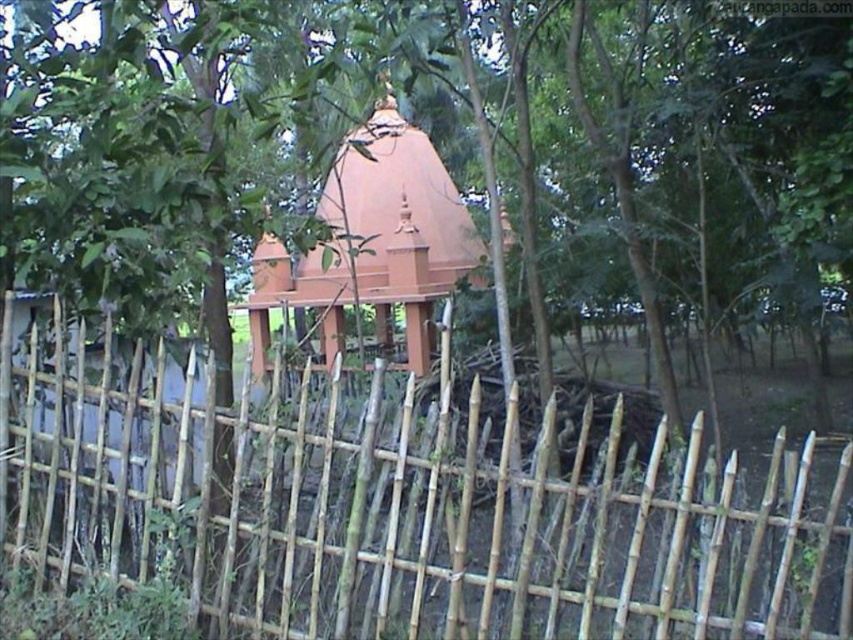
You are a construction worker needing to transport materials from the bamboo fence at center to the matte orange water tower at center. The materials require a cart that can carry up to 15 meters. Can you safely transport the materials using this cart?

The distance between the bamboo fence at center and the matte orange water tower at center is 10.34 meters, which is within the cart capacity of 15 meters. Therefore, you can safely transport the materials using this cart.

You are standing in front of the traditional structure and notice both the bamboo fence at center and the matte orange water tower at center. Which object is taller?

The bamboo fence at center is taller than the matte orange water tower at center.

You are standing in front of the temple structure and want to touch the bamboo fence. Is the point at coordinate (401, 506) on the bamboo fence at center?

Yes, the point at coordinate (401, 506) is on the bamboo fence at center as stated in the objects description.